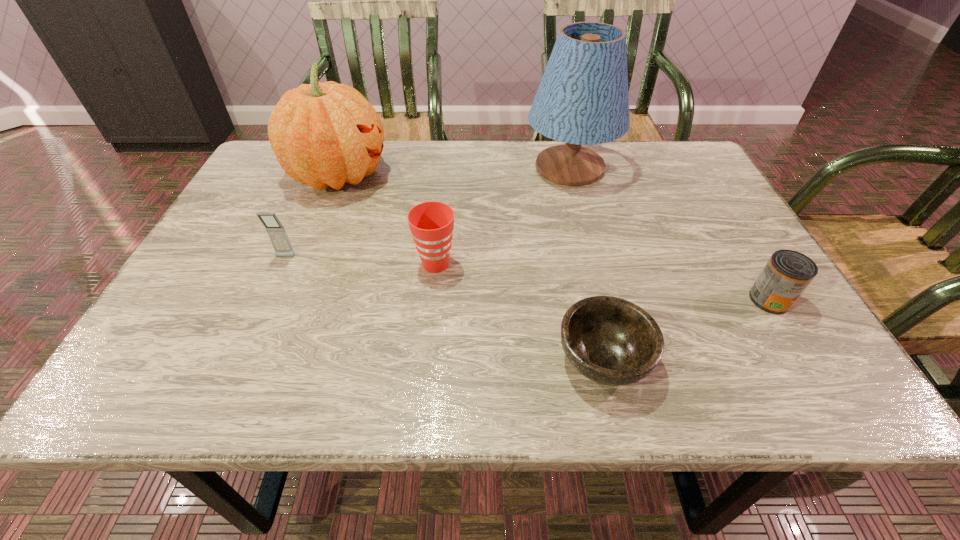
You are a GUI agent. You are given a task and a screenshot of the screen. Output one action in this format:
    pyautogui.click(x=<x>, y=<y>)
    Task: Click on the vacant space located 0.190m on the front-facing side of the cellular telephone
    
    Given the screenshot: What is the action you would take?
    (x=253, y=329)

This screenshot has width=960, height=540. What are the coordinates of `free space located 0.100m on the right of the third object from left to right` in the screenshot? It's located at (503, 264).

Image resolution: width=960 pixels, height=540 pixels. Identify the location of vacant space located on the back of the rightmost object. point(747,262).

The width and height of the screenshot is (960, 540). In order to click on blank space located 0.080m on the back of the nearest object in this screenshot , I will do `click(588, 291)`.

Image resolution: width=960 pixels, height=540 pixels. What are the coordinates of `lampshade that is at the far edge` in the screenshot? It's located at (582, 99).

This screenshot has height=540, width=960. In order to click on pumpkin that is at the far edge in this screenshot , I will do `click(326, 134)`.

I want to click on object present at the near edge, so click(x=609, y=340).

Locate an element on the screen. The image size is (960, 540). object positioned at the left edge is located at coordinates (326, 134).

You are a GUI agent. You are given a task and a screenshot of the screen. Output one action in this format:
    pyautogui.click(x=<x>, y=<y>)
    Task: Click on the object that is at the right edge
    
    Given the screenshot: What is the action you would take?
    pyautogui.click(x=787, y=274)

This screenshot has width=960, height=540. Identify the location of object present at the far left corner. (326, 134).